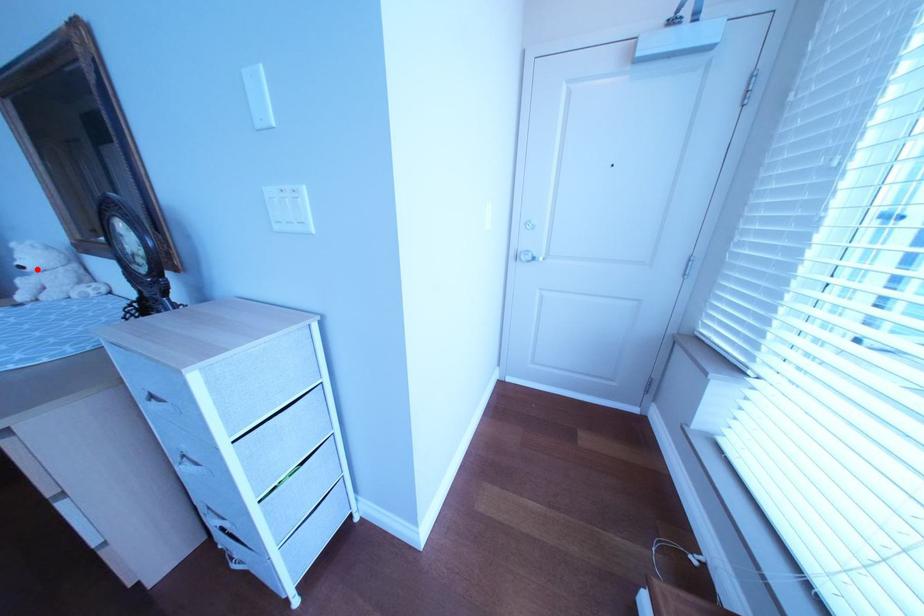
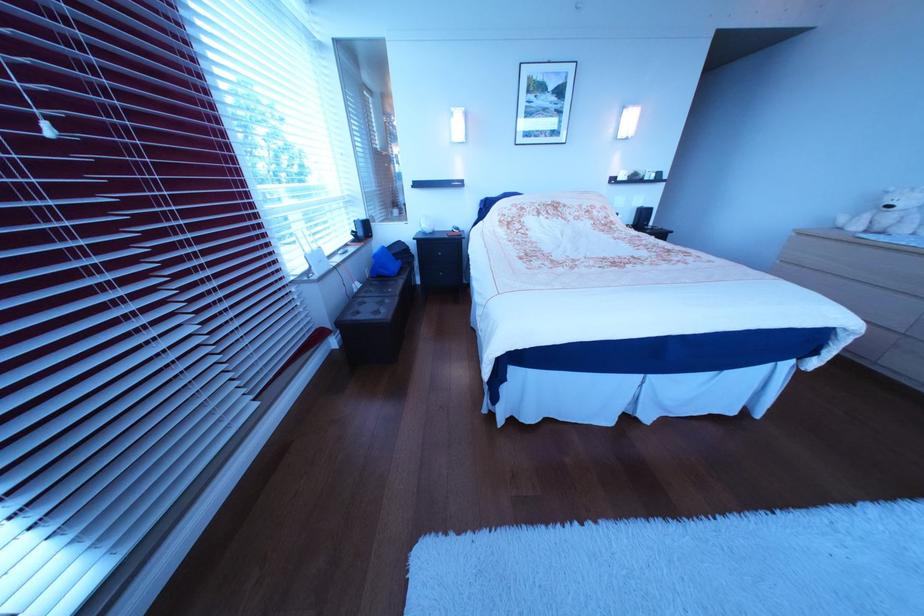
The point at the highlighted location is marked in the first image. Where is the corresponding point in the second image?

(906, 209)